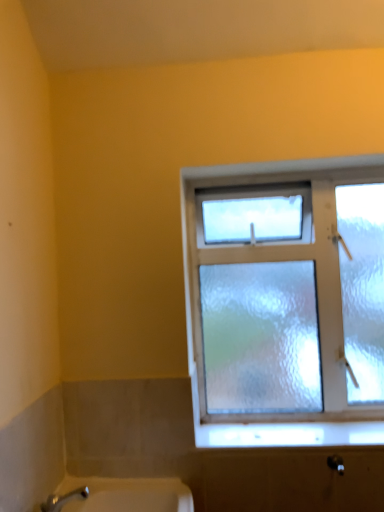
Where is `frosted glass window at upper right`? The height and width of the screenshot is (512, 384). frosted glass window at upper right is located at coordinates (285, 301).

What is the approximate height of frosted glass window at upper right?

frosted glass window at upper right is 35.97 inches in height.

This screenshot has width=384, height=512. What do you see at coordinates (285, 301) in the screenshot?
I see `frosted glass window at upper right` at bounding box center [285, 301].

The width and height of the screenshot is (384, 512). What do you see at coordinates (288, 434) in the screenshot? I see `white frosted glass at lower center` at bounding box center [288, 434].

You are a GUI agent. You are given a task and a screenshot of the screen. Output one action in this format:
    pyautogui.click(x=<x>, y=<y>)
    Task: Click on the white frosted glass at lower center
    Image resolution: width=384 pixels, height=512 pixels.
    Given the screenshot: What is the action you would take?
    pyautogui.click(x=288, y=434)

At what (x,y) coordinates should I click in order to perform the action: click on frosted glass window at upper right. Please return your answer as a coordinate pair (x, y). The image size is (384, 512). Looking at the image, I should click on (285, 301).

Considering the positions of objects white frosted glass at lower center and frosted glass window at upper right in the image provided, who is more to the left, white frosted glass at lower center or frosted glass window at upper right?

white frosted glass at lower center is more to the left.

Between white frosted glass at lower center and frosted glass window at upper right, which one is positioned in front?

Positioned in front is white frosted glass at lower center.

Considering the points (214, 434) and (383, 227), which point is behind, point (214, 434) or point (383, 227)?

Positioned behind is point (383, 227).

From the image's perspective, is white frosted glass at lower center on top of frosted glass window at upper right?

No, from the image's perspective, white frosted glass at lower center is not over frosted glass window at upper right.

From a real-world perspective, is white frosted glass at lower center positioned under frosted glass window at upper right based on gravity?

Correct, in the physical world, white frosted glass at lower center is lower than frosted glass window at upper right.

Which object is thinner, white frosted glass at lower center or frosted glass window at upper right?

Thinner between the two is frosted glass window at upper right.

Based on the photo, can you confirm if white frosted glass at lower center is taller than frosted glass window at upper right?

No.

Looking at the image, does white frosted glass at lower center seem bigger or smaller compared to frosted glass window at upper right?

white frosted glass at lower center is smaller than frosted glass window at upper right.

Based on the photo, is white frosted glass at lower center located outside frosted glass window at upper right?

Yes, white frosted glass at lower center is not within frosted glass window at upper right.

Is white frosted glass at lower center far from frosted glass window at upper right?

No, white frosted glass at lower center is in close proximity to frosted glass window at upper right.

Is white frosted glass at lower center aimed at frosted glass window at upper right?

No.

What's the angular difference between white frosted glass at lower center and frosted glass window at upper right's facing directions?

There is a 0.0812-degree angle between the facing directions of white frosted glass at lower center and frosted glass window at upper right.

How much distance is there between white frosted glass at lower center and frosted glass window at upper right?

white frosted glass at lower center and frosted glass window at upper right are 12.30 inches apart from each other.

You are a GUI agent. You are given a task and a screenshot of the screen. Output one action in this format:
    pyautogui.click(x=<x>, y=<y>)
    Task: Click on the window above the white frosted glass at lower center (from a real-world perspective)
    Image resolution: width=384 pixels, height=512 pixels.
    Given the screenshot: What is the action you would take?
    pyautogui.click(x=285, y=301)

Would you say frosted glass window at upper right is to the left or to the right of white frosted glass at lower center in the picture?

Based on their positions, frosted glass window at upper right is located to the right of white frosted glass at lower center.

Considering the positions of objects frosted glass window at upper right and white frosted glass at lower center in the image provided, who is in front, frosted glass window at upper right or white frosted glass at lower center?

white frosted glass at lower center is more forward.

Does point (335, 351) come in front of point (207, 436)?

No, (335, 351) is further to viewer.

From the image's perspective, which one is positioned higher, frosted glass window at upper right or white frosted glass at lower center?

frosted glass window at upper right is shown above in the image.

From a real-world perspective, which object rests below the other?

white frosted glass at lower center.

Considering the sizes of objects frosted glass window at upper right and white frosted glass at lower center in the image provided, who is thinner, frosted glass window at upper right or white frosted glass at lower center?

frosted glass window at upper right.

Between frosted glass window at upper right and white frosted glass at lower center, which one has less height?

With less height is white frosted glass at lower center.

Between frosted glass window at upper right and white frosted glass at lower center, which one has larger size?

With larger size is frosted glass window at upper right.

Is frosted glass window at upper right inside the boundaries of white frosted glass at lower center, or outside?

frosted glass window at upper right is not enclosed by white frosted glass at lower center.

Is frosted glass window at upper right not close to white frosted glass at lower center?

frosted glass window at upper right is actually quite close to white frosted glass at lower center.

Is frosted glass window at upper right turned away from white frosted glass at lower center?

frosted glass window at upper right is not turned away from white frosted glass at lower center.

How many degrees apart are the facing directions of frosted glass window at upper right and white frosted glass at lower center?

They differ by 0.0812 degrees in their facing directions.

This screenshot has width=384, height=512. In order to click on window sill lying on the left of frosted glass window at upper right in this screenshot , I will do `click(288, 434)`.

At what (x,y) coordinates should I click in order to perform the action: click on window sill below the frosted glass window at upper right (from the image's perspective). Please return your answer as a coordinate pair (x, y). The image size is (384, 512). Looking at the image, I should click on (288, 434).

The height and width of the screenshot is (512, 384). I want to click on window sill in front of the frosted glass window at upper right, so click(288, 434).